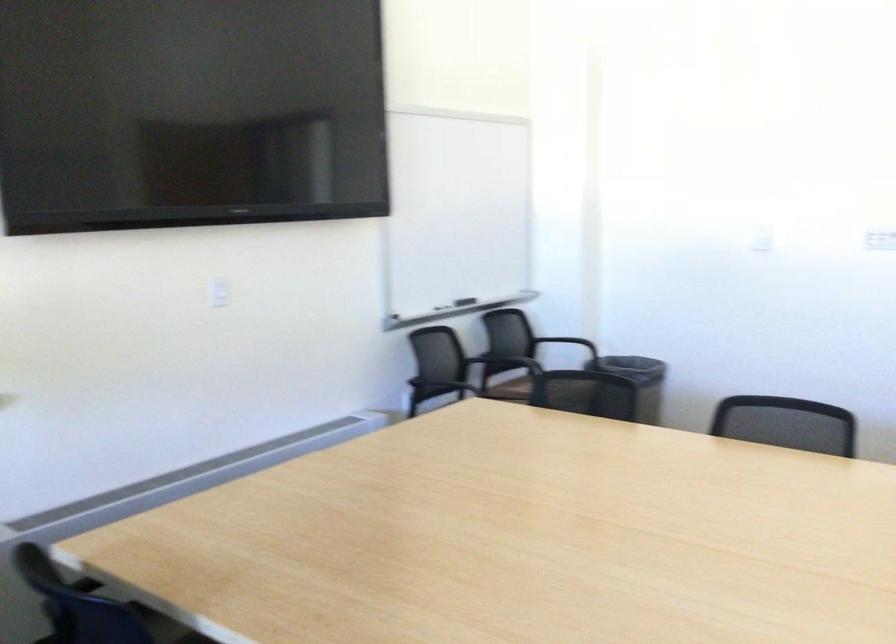
Where is `whiteboard eraser`? This screenshot has height=644, width=896. whiteboard eraser is located at coordinates pyautogui.click(x=463, y=301).